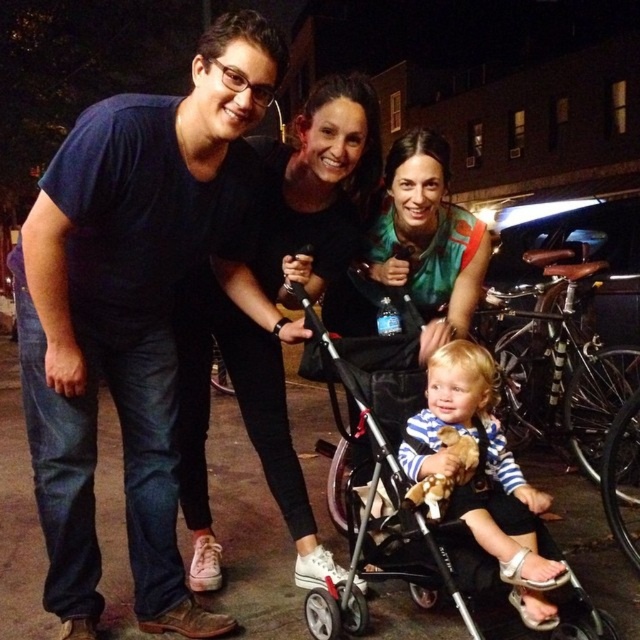
Is black matte sneakers at lower center further to camera compared to shiny black bicycle at right?

No.

Is point (259, 433) positioned in front of point (552, 278)?

Yes, it is.

Where is `black matte sneakers at lower center`? The height and width of the screenshot is (640, 640). black matte sneakers at lower center is located at coordinates (320, 188).

Consider the image. Who is more distant from viewer, (550,387) or (436,204)?

Point (550,387)

Can you confirm if shiny black bicycle at right is shorter than green matte shirt at center?

No, shiny black bicycle at right is not shorter than green matte shirt at center.

Who is more forward, (541, 364) or (481, 266)?

Point (481, 266)

The image size is (640, 640). Find the location of `shiny black bicycle at right`. shiny black bicycle at right is located at coordinates (557, 364).

Can you confirm if black matte sneakers at lower center is bigger than green matte shirt at center?

Correct, black matte sneakers at lower center is larger in size than green matte shirt at center.

In the scene shown: Is black matte sneakers at lower center above green matte shirt at center?

Incorrect, black matte sneakers at lower center is not positioned above green matte shirt at center.

This screenshot has height=640, width=640. What do you see at coordinates (320, 188) in the screenshot?
I see `black matte sneakers at lower center` at bounding box center [320, 188].

You are a GUI agent. You are given a task and a screenshot of the screen. Output one action in this format:
    pyautogui.click(x=<x>, y=<y>)
    Task: Click on the black matte sneakers at lower center
    
    Given the screenshot: What is the action you would take?
    pyautogui.click(x=320, y=188)